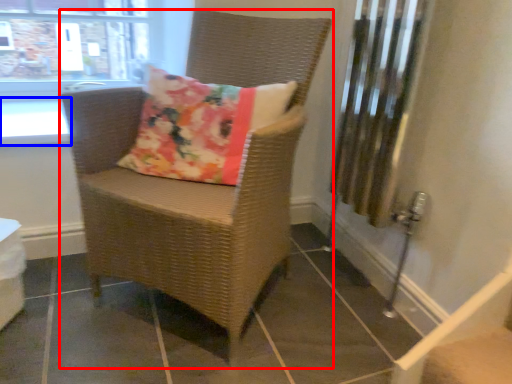
Question: Among these objects, which one is farthest to the camera, chair (highlighted by a red box) or window sill (highlighted by a blue box)?

Choices:
 (A) chair
 (B) window sill

Answer: (B)